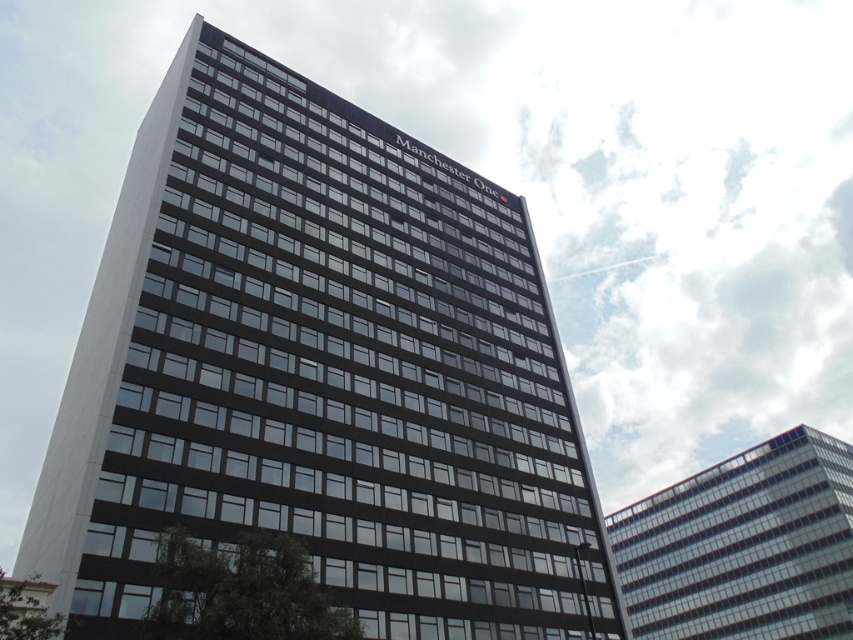
Who is taller, black glass building at center or transparent glass building at upper right?

black glass building at center is taller.

Who is more forward, (518, 454) or (703, 634)?

Point (518, 454) is in front.

Which is behind, point (146, 552) or point (780, 484)?

The point (780, 484) is behind.

At what (x,y) coordinates should I click in order to perform the action: click on black glass building at center. Please return your answer as a coordinate pair (x, y). Looking at the image, I should click on (318, 372).